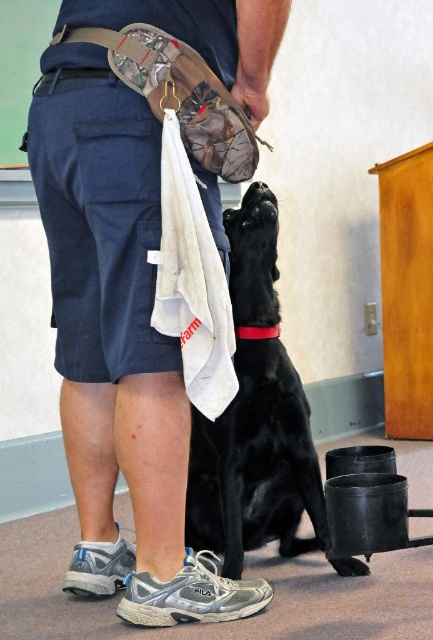
You are a trainer trying to position your black smooth dog at center precisely at point A. The dog is currently at point B. What direction should you guide the dog to move to reach point A?

The black smooth dog at center is currently at point B, which is at coordinates [255,417]. To reach point A, you need to determine the direction based on the coordinates of point A. However, since the coordinates of point A are not provided, I cannot specify the exact direction. Please provide the coordinates of point A for further guidance.

You are a photographer positioned behind the black smooth dog at center. You want to take a photo of the green matte bulletin board at upper left without the dog blocking the view. Is the dog currently in the way of the bulletin board?

The black smooth dog at center is in front of the green matte bulletin board at upper left, so yes, the dog is blocking the view of the bulletin board and would need to be moved or repositioned to capture an unobstructed photo.

Consider the image. You are a photographer standing in the room and want to take a photo of the black smooth dog at center and the green matte bulletin board at upper left. Which object is positioned to the right side of the other?

The black smooth dog at center is to the right of the green matte bulletin board at upper left.